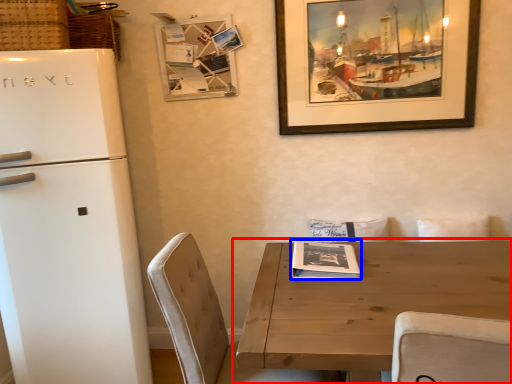
Question: Which point is closer to the camera, table (highlighted by a red box) or magazine (highlighted by a blue box)?

Choices:
 (A) table
 (B) magazine

Answer: (A)